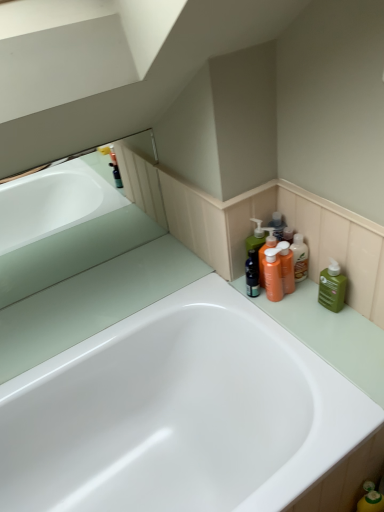
Where is `free space on the front side of translucent orange bottle at right`? Image resolution: width=384 pixels, height=512 pixels. free space on the front side of translucent orange bottle at right is located at coordinates pyautogui.click(x=311, y=316).